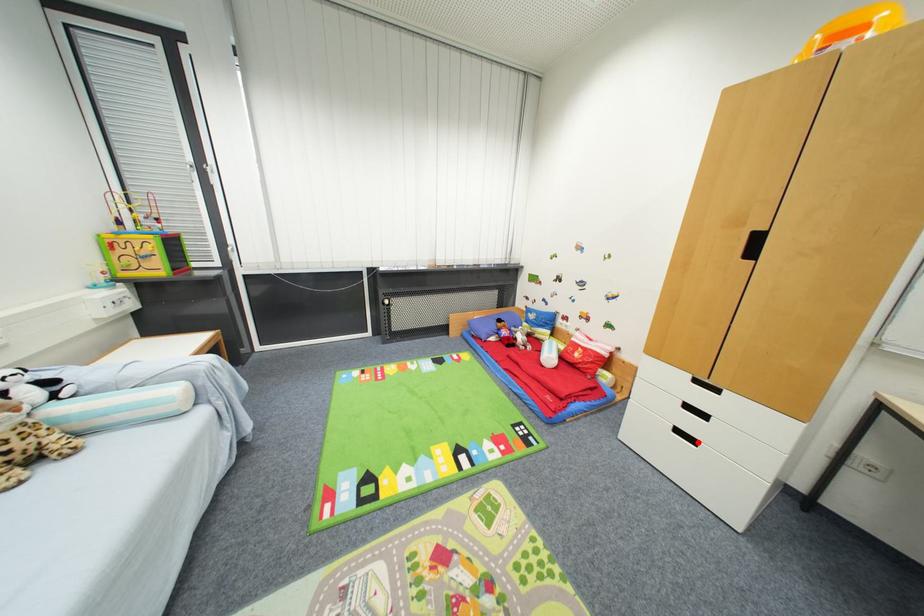
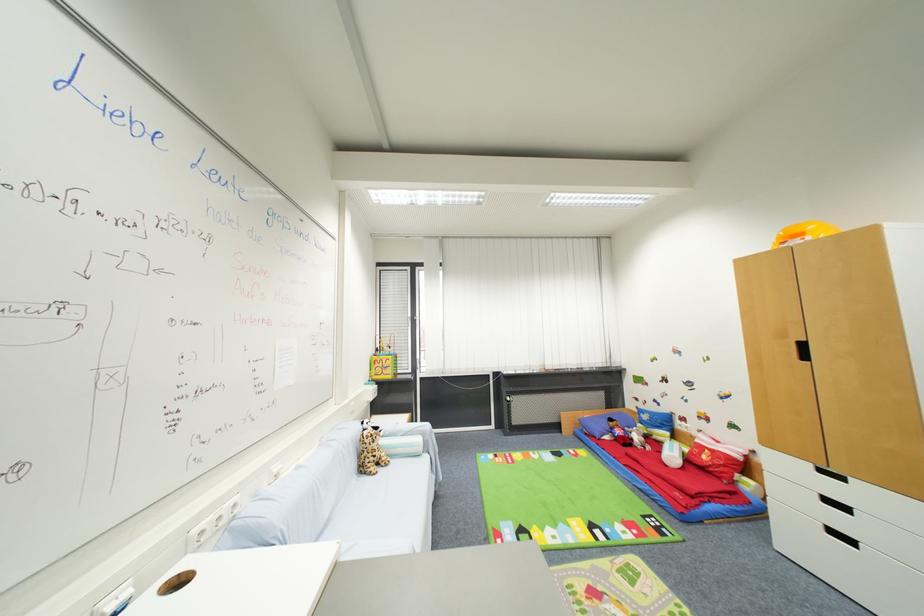
In the second image, find the point that corresponds to the highlighted location in the first image.

(857, 544)